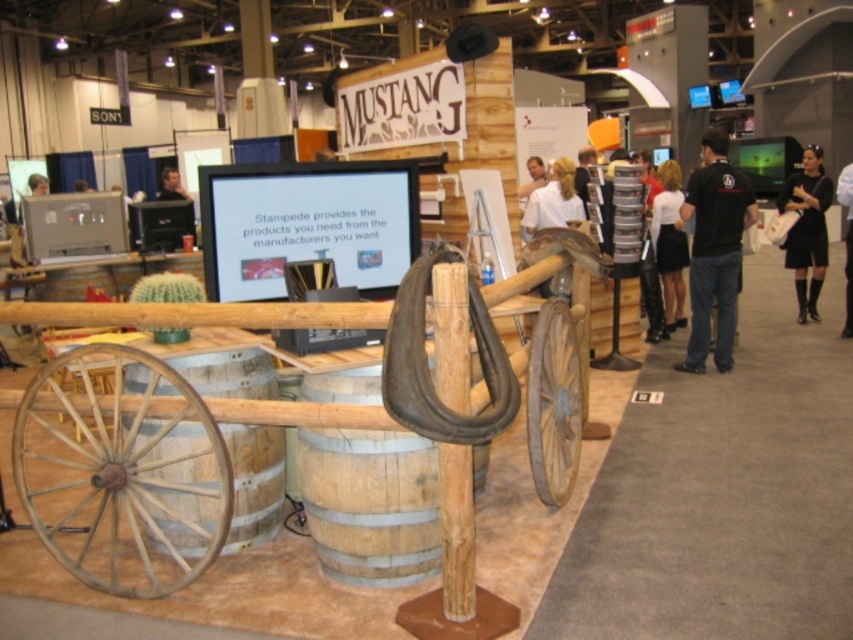
Who is higher up, wooden barrel at center or rustic wood wheel at lower right?

rustic wood wheel at lower right is higher up.

Between wooden barrel at center and rustic wood wheel at lower right, which one is positioned lower?

wooden barrel at center is below.

Does point (369, 557) come behind point (556, 412)?

No, it is in front of (556, 412).

In order to click on wooden barrel at center in this screenshot , I will do `click(370, 504)`.

Is brown wooden barrel at lower left wider than smooth wooden barrel at center?

Answer: Yes, brown wooden barrel at lower left is wider than smooth wooden barrel at center.

This screenshot has width=853, height=640. What do you see at coordinates (219, 364) in the screenshot?
I see `brown wooden barrel at lower left` at bounding box center [219, 364].

Image resolution: width=853 pixels, height=640 pixels. Find the location of `brown wooden barrel at lower left`. brown wooden barrel at lower left is located at coordinates (219, 364).

Is black cotton shirt at right thinner than black dress at right?

Correct, black cotton shirt at right's width is less than black dress at right's.

At what (x,y) coordinates should I click in order to perform the action: click on black cotton shirt at right. Please return your answer as a coordinate pair (x, y). Image resolution: width=853 pixels, height=640 pixels. Looking at the image, I should click on (714, 250).

Which is in front, point (694, 368) or point (801, 189)?

Point (694, 368) is in front.

The image size is (853, 640). What are the coordinates of `black cotton shirt at right` in the screenshot? It's located at (714, 250).